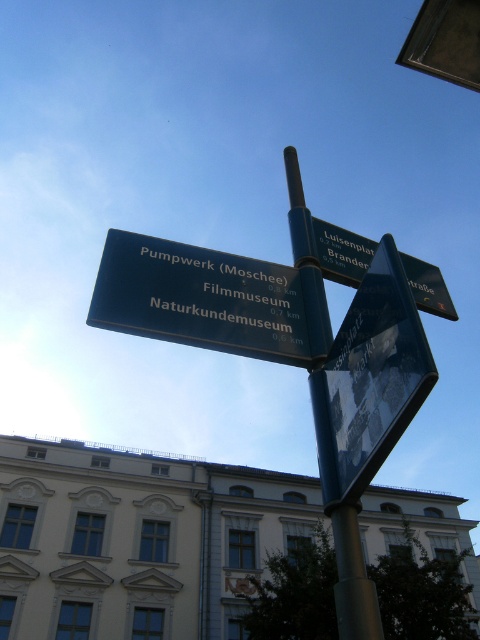
Question: Can you confirm if black plastic sign at upper center is positioned below metallic reflective sign at center?

Choices:
 (A) yes
 (B) no

Answer: (B)

Question: Which object appears farthest from the camera in this image?

Choices:
 (A) green metallic sign at center
 (B) black plastic sign at upper center
 (C) green metallic street sign at upper center

Answer: (B)

Question: Can you confirm if green metallic sign at center is positioned below green metallic pole at center?

Choices:
 (A) no
 (B) yes

Answer: (A)

Question: Estimate the real-world distances between objects in this image. Which object is closer to the metallic reflective sign at center?

Choices:
 (A) black plastic sign at upper center
 (B) green metallic street sign at upper center
 (C) green metallic pole at center
 (D) green metallic sign at center

Answer: (D)

Question: Which point is closer to the camera?

Choices:
 (A) (333, 481)
 (B) (297, 289)
 (C) (324, 244)
 (D) (305, 316)

Answer: (A)

Question: Does green metallic sign at center have a smaller size compared to green metallic street sign at upper center?

Choices:
 (A) no
 (B) yes

Answer: (B)